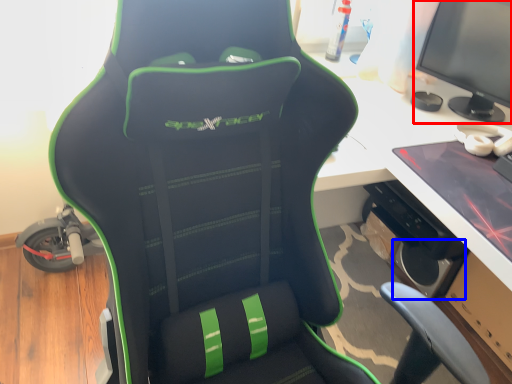
Question: Which of the following is the farthest to the observer, computer monitor (highlighted by a red box) or speaker (highlighted by a blue box)?

Choices:
 (A) computer monitor
 (B) speaker

Answer: (B)